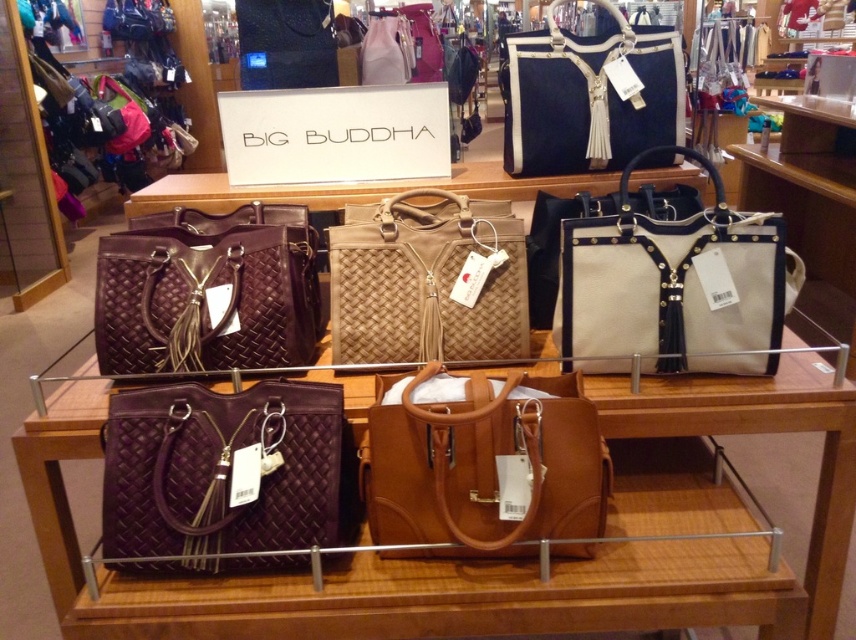
Consider the image. Between beige canvas tote at center and black woven tote at upper center, which one appears on the right side from the viewer's perspective?

From the viewer's perspective, beige canvas tote at center appears more on the right side.

Identify the location of beige canvas tote at center. [x=673, y=288].

Which of these two, tan leather tote at center or matte beige tote at center, stands shorter?

tan leather tote at center is shorter.

Locate an element on the screen. This screenshot has width=856, height=640. tan leather tote at center is located at coordinates (485, 465).

Find the location of a particular element. The image size is (856, 640). tan leather tote at center is located at coordinates (485, 465).

Is black woven tote at upper center further to the viewer compared to matte beige tote at center?

No, it is in front of matte beige tote at center.

At what (x,y) coordinates should I click in order to perform the action: click on black woven tote at upper center. Please return your answer as a coordinate pair (x, y). The image size is (856, 640). Looking at the image, I should click on (589, 97).